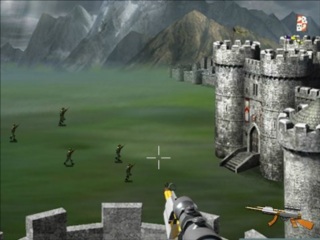
The height and width of the screenshot is (240, 320). Find the location of `stairwell`. stairwell is located at coordinates point(234,159).